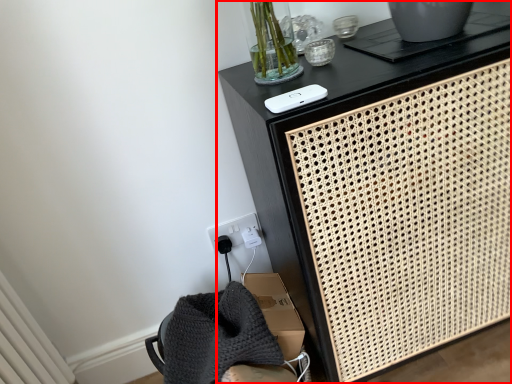
Question: From the image's perspective, what is the correct spatial positioning of furniture (annotated by the red box) in reference to ipod?

Choices:
 (A) above
 (B) below

Answer: (B)